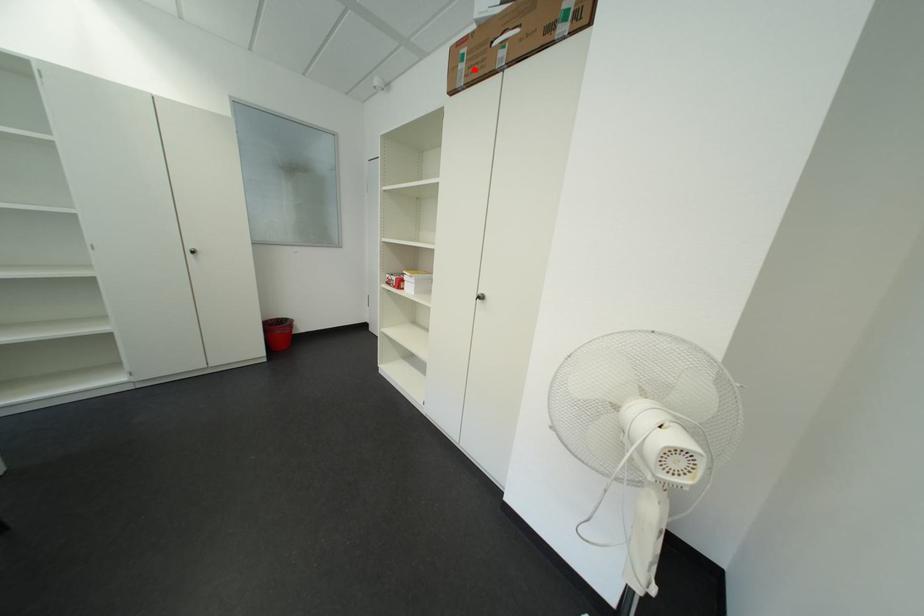
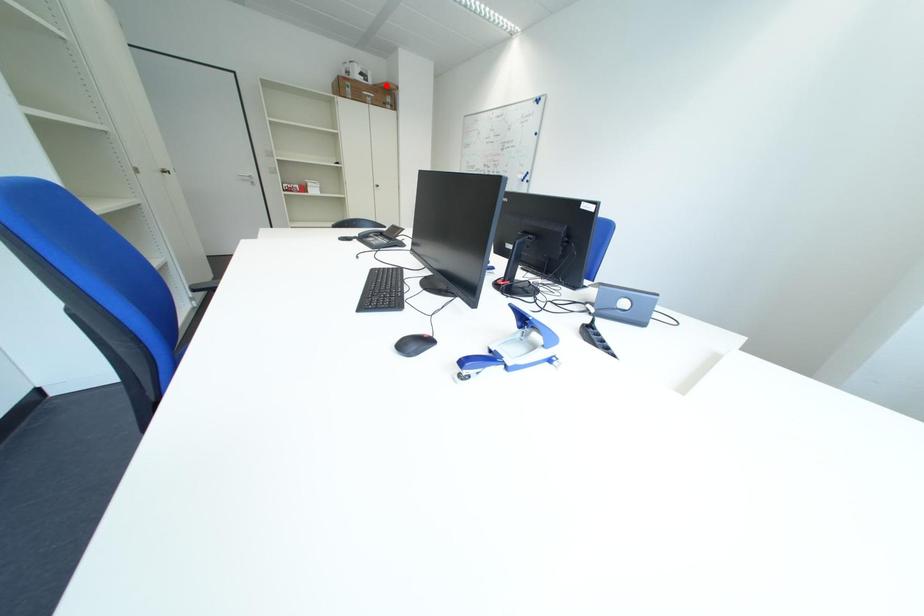
I am providing you with two images of the same scene from different viewpoints. A red point is marked on the first image and another point is marked on the second image. Do the highlighted points in image1 and image2 indicate the same real-world spot?

No